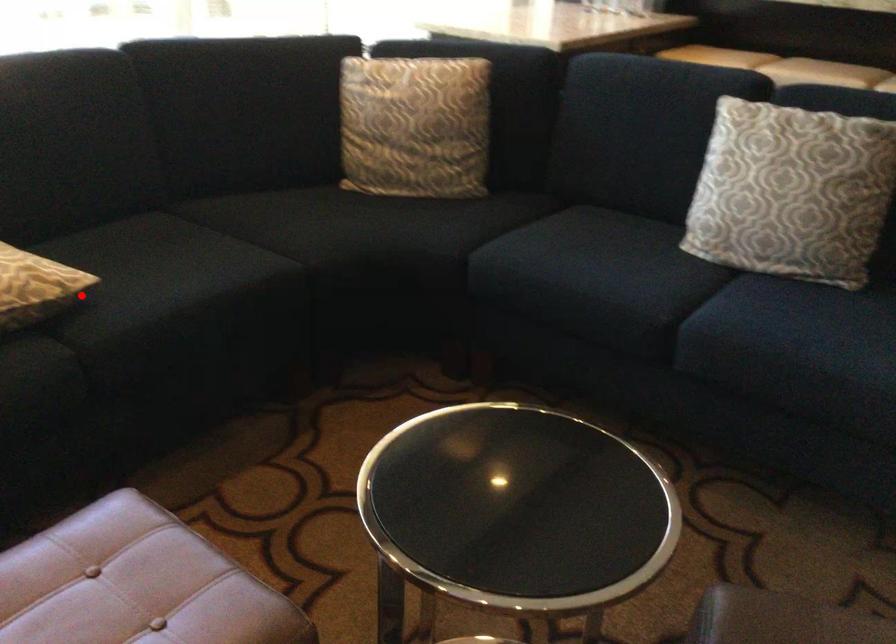
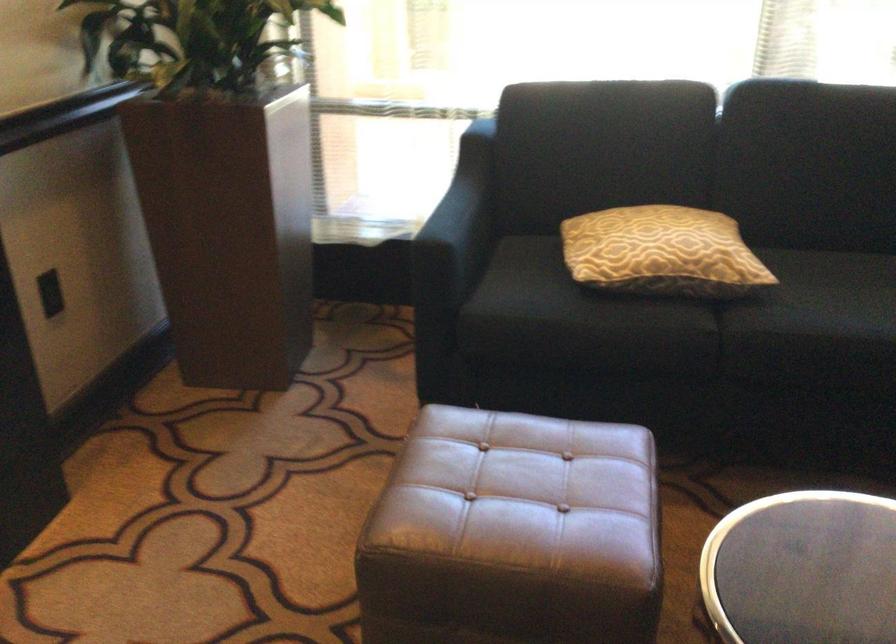
Where in the second image is the point corresponding to the highlighted location from the first image?

(752, 289)